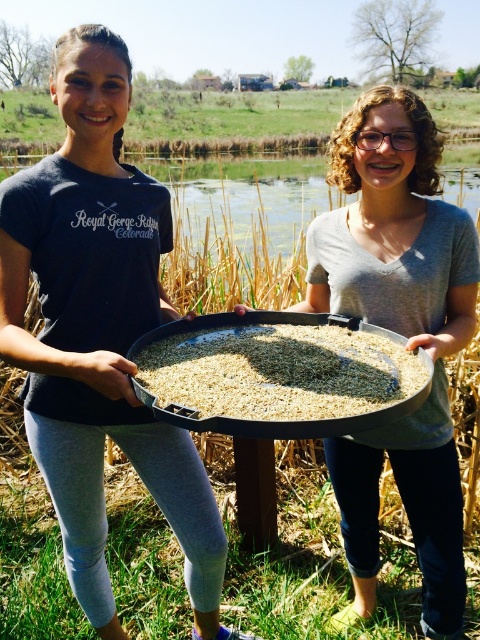
You are a photographer standing at point [157,262]. You need to take a photo of the two people in the scene. Since they are 2.01 meters apart, will you be able to capture both of them in the frame if your camera has a 1.5 meter wide field of view?

The two people are 2.01 meters apart, which is slightly wider than the camera field of view of 1.5 meters. Therefore, you will not be able to capture both of them in the frame.

Looking at this image, you are organizing a picnic and need to transport the matte gray tray at center and the brown matte rice at center. If you have a backpack with a 30 cm width limit, which item can fit through the backpack compartment without needing to adjust its position?

The matte gray tray at center has a lesser width compared to brown matte rice at center, so the matte gray tray at center can fit through the backpack compartment without needing to adjust its position since it is narrower.